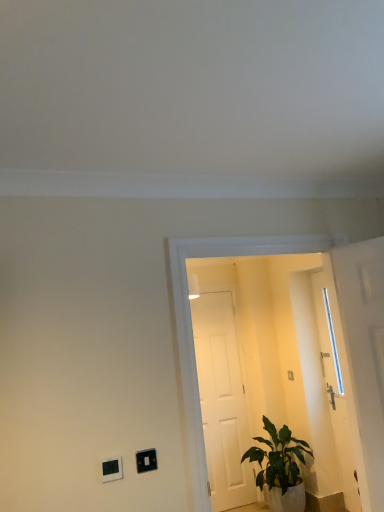
Question: In the image, is white matte door at center, acting as the 2th door starting from the right, positioned in front of or behind green leafy plant at lower right?

Choices:
 (A) behind
 (B) front

Answer: (A)

Question: In terms of size, does white matte door at center, the 2th door from the front, appear bigger or smaller than green leafy plant at lower right?

Choices:
 (A) small
 (B) big

Answer: (A)

Question: Which object is the farthest from the transparent glass door at center?

Choices:
 (A) white matte door at center, acting as the 2th door starting from the right
 (B) black plastic light switch at lower left, which ranks as the 2th light switch in right-to-left order
 (C) white glossy door at right, placed as the 2th door when sorted from back to front
 (D) green leafy plant at lower right
 (E) black plastic/light switch at lower left, marked as the 2th light switch in a left-to-right arrangement

Answer: (B)

Question: Estimate the real-world distances between objects in this image. Which object is closer to the black plastic/light switch at lower left, acting as the 1th light switch starting from the right?

Choices:
 (A) green leafy plant at lower right
 (B) white glossy door at right, placed as the second door when sorted from left to right
 (C) transparent glass door at center
 (D) black plastic light switch at lower left, positioned as the 2th light switch in back-to-front order
 (E) white matte door at center, the 2th door from the front

Answer: (D)